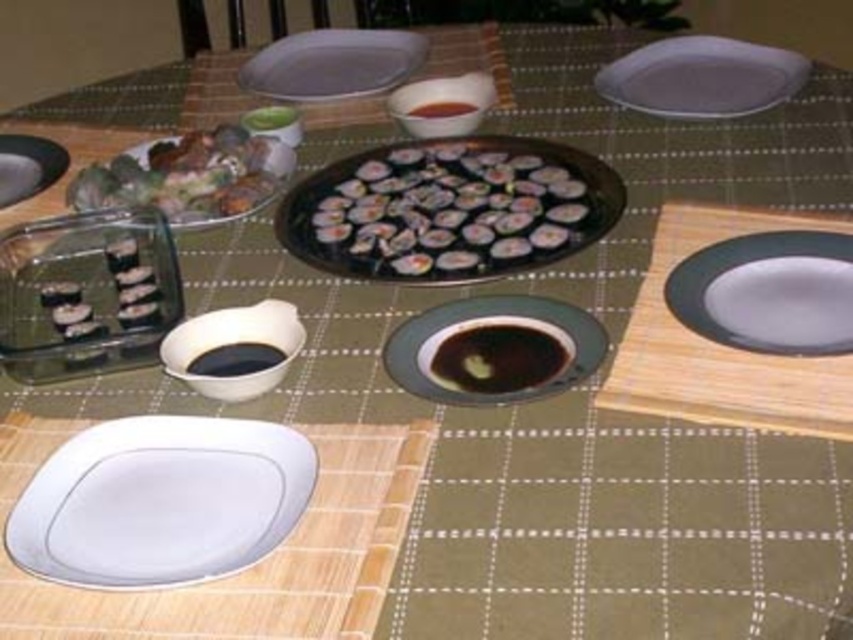
Question: Can you confirm if white glossy plate at right is positioned to the right of white glossy plate at upper right?

Choices:
 (A) yes
 (B) no

Answer: (B)

Question: Is white glossy plate at upper right above black glossy soy sauce at center?

Choices:
 (A) yes
 (B) no

Answer: (A)

Question: Which point appears farthest from the camera in this image?

Choices:
 (A) (517, 364)
 (B) (38, 193)
 (C) (772, 232)

Answer: (B)

Question: Is white glossy plate at lower left to the right of white glossy plate at upper right from the viewer's perspective?

Choices:
 (A) yes
 (B) no

Answer: (B)

Question: Among these points, which one is nearest to the camera?

Choices:
 (A) coord(811,257)
 (B) coord(764,45)
 (C) coord(473,163)
 (D) coord(242,152)

Answer: (A)

Question: Which point is closer to the camera taking this photo?

Choices:
 (A) (167, 250)
 (B) (670, 42)

Answer: (A)